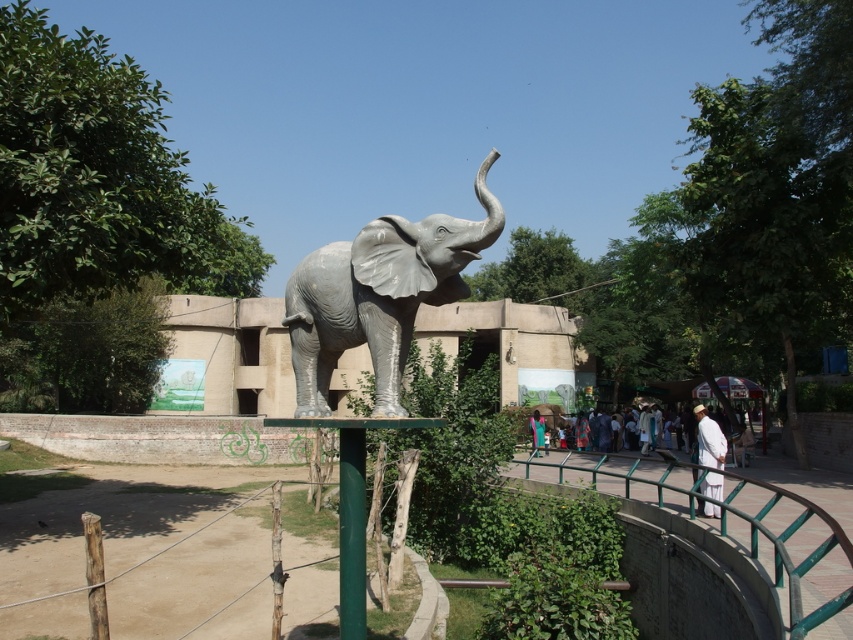
You are standing at the center of the image and want to find the green metal railing at lower right. In which direction should you look to locate it?

You should look to the lower right direction to locate the green metal railing at lower right since it is positioned at point (728, 561).

You are standing in front of the elephant statue and want to touch both the green metal railing at lower right and the light blue fabric at center. Which object will you reach first?

The green metal railing at lower right is closer to the viewer than the light blue fabric at center, so you will reach the green metal railing at lower right first.

You are a maintenance worker needing to reach the top of both the green metal railing at lower right and the green painted metal pole at lower center. Which object will require you to climb higher?

The green metal railing at lower right has a greater height compared to the green painted metal pole at lower center, so you will need to climb higher to reach the top of the green metal railing at lower right.